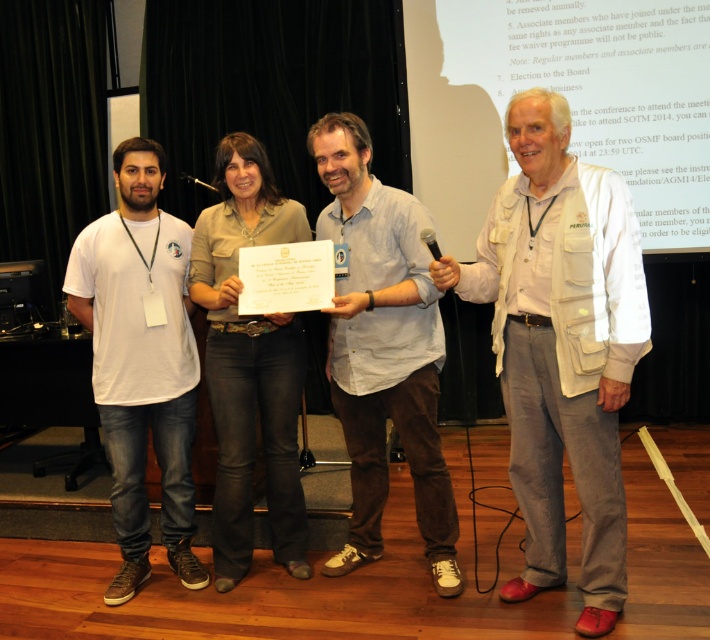
From the picture: You are a stagehand who needs to adjust the microphone stand. You are currently standing 2 meters away from the camera. Can you reach the black plastic microphone at upper center without moving closer?

The black plastic microphone at upper center is 2.11 meters away from the camera. Since you are 2 meters away from the camera, you are 0.11 meters closer than the microphone. Therefore, you can reach the black plastic microphone at upper center without moving closer.

In the scene shown: You are an event photographer at the back of the stage. You need to capture a photo where both the white textured vest at center and the black plastic microphone at upper center are clearly visible. Based on their positions, will the microphone block the vest in your shot?

The white textured vest at center is below the black plastic microphone at upper center, so the microphone will not block the vest in your shot.

Looking at this image, you are an event organizer who needs to adjust the stage setup. You want to place a new podium between the white cotton shirt at center and the black plastic microphone at upper center. Based on their current positions, where should you position the podium relative to these two objects?

The podium should be placed between the white cotton shirt at center and the black plastic microphone at upper center, as the white cotton shirt at center is positioned to the left of the microphone. This will ensure the podium is centered between them.